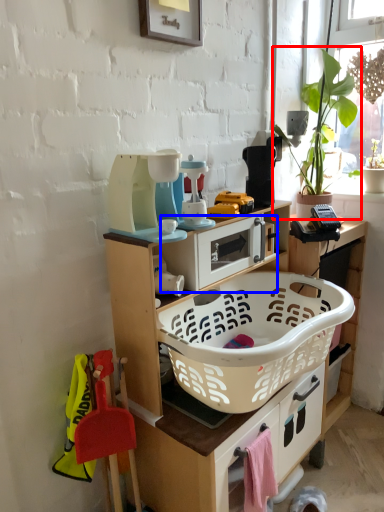
Question: Which object is closer to the camera taking this photo, houseplant (highlighted by a red box) or appliance (highlighted by a blue box)?

Choices:
 (A) houseplant
 (B) appliance

Answer: (B)